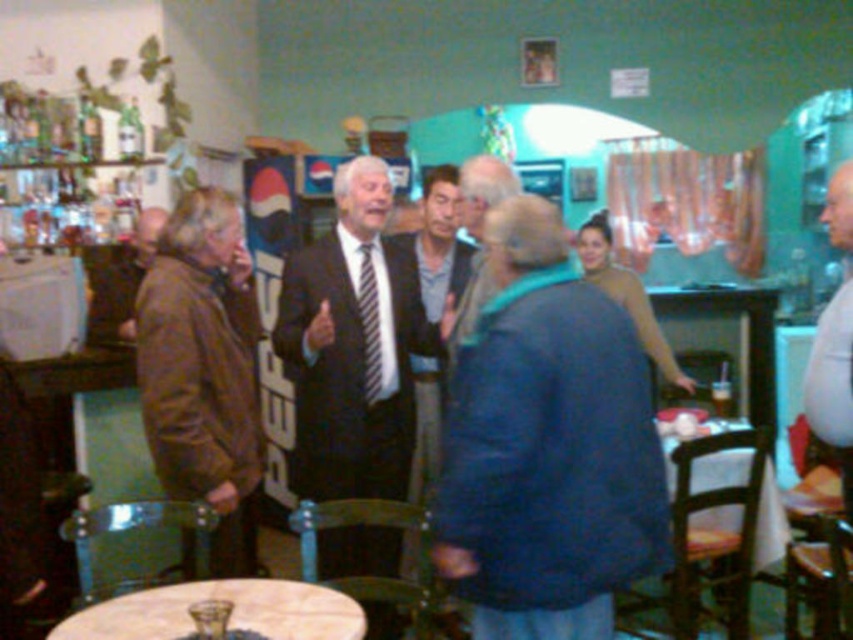
You are organizing a small event and need to place a 1.5 meter long banner between the white marble table at center and the brown leather jacket at left. Can the banner fit between them?

The white marble table at center occupies less space than brown leather jacket at left, so the distance between them may be sufficient to accommodate a 1.5 meter banner. However, without exact measurements of the space between the objects, it is uncertain if the banner will fit perfectly.